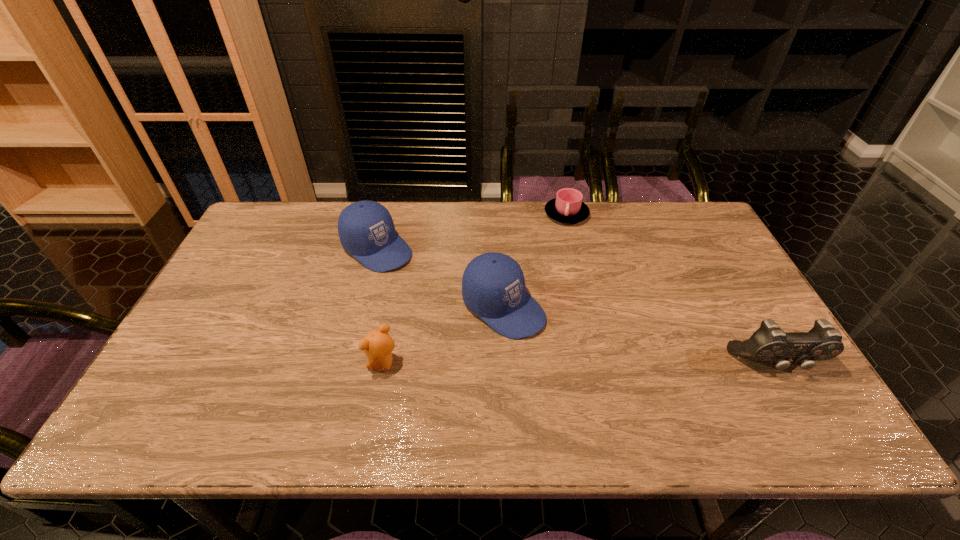
Image resolution: width=960 pixels, height=540 pixels. Identify the location of blank space at the far right corner of the desktop. (687, 221).

In the image, there is a desktop. Where is `vacant area at the near right corner`? This screenshot has height=540, width=960. vacant area at the near right corner is located at coordinates (788, 376).

I want to click on empty location between the control and the left cap, so click(x=577, y=306).

Identify the location of free space between the third object from left to right and the cup. (535, 260).

Image resolution: width=960 pixels, height=540 pixels. I want to click on vacant space that is in between the cup and the third object from right to left, so click(535, 260).

Identify the location of empty space that is in between the left cap and the rightmost object. This screenshot has width=960, height=540. (577, 306).

Find the location of `free space between the farther cap and the third object from right to left`. free space between the farther cap and the third object from right to left is located at coordinates (441, 278).

Where is `free space that is in between the right cap and the left cap`? free space that is in between the right cap and the left cap is located at coordinates 441,278.

The height and width of the screenshot is (540, 960). What are the coordinates of `empty location between the cup and the third farthest object` in the screenshot? It's located at (535, 260).

Where is `vacant area that lies between the farther cap and the nearer cap`? vacant area that lies between the farther cap and the nearer cap is located at coordinates (441, 278).